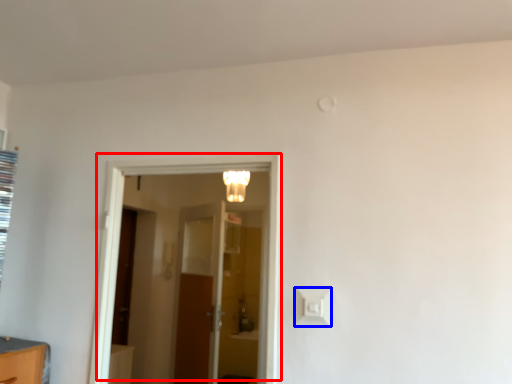
Question: Which of the following is the farthest to the observer, door (highlighted by a red box) or light switch (highlighted by a blue box)?

Choices:
 (A) door
 (B) light switch

Answer: (A)